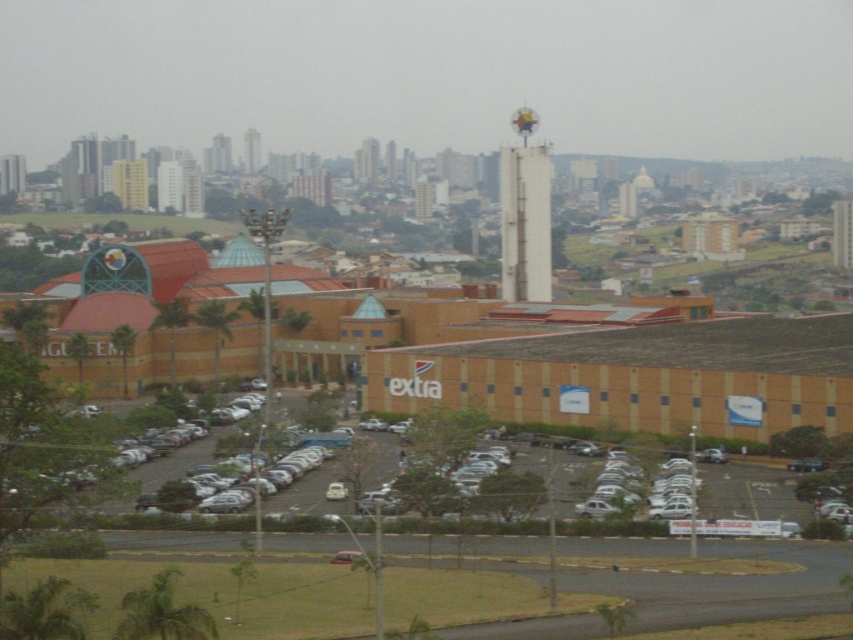
You are standing in the city square and see the white concrete bell tower at center and the white concrete tower at upper center. Which one is nearer to you?

The white concrete bell tower at center is closer to the viewer than the white concrete tower at upper center.

You are a tourist standing in the city square and want to take a photo of both the white concrete bell tower at center and the white concrete tower at upper center. Can you position yourself so that both are visible in the same frame without one blocking the other?

The white concrete bell tower at center is positioned under the white concrete tower at upper center, so if you stand at a distance where both can be captured, the lower bell tower might be partially obscured by the upper tower. Adjust your angle or move further back to ensure both are visible without overlap.

You are standing at the base of the white concrete bell tower at center. You want to take a photo of the tower with a camera that has a maximum zoom range of 200 meters. Will you be able to capture the entire tower in the photo without moving the camera?

The distance between the white concrete bell tower at center and the camera is 294.63 meters. Since the camera can only zoom up to 200 meters, you will not be able to capture the entire tower without moving closer or using a different camera with a longer zoom range.